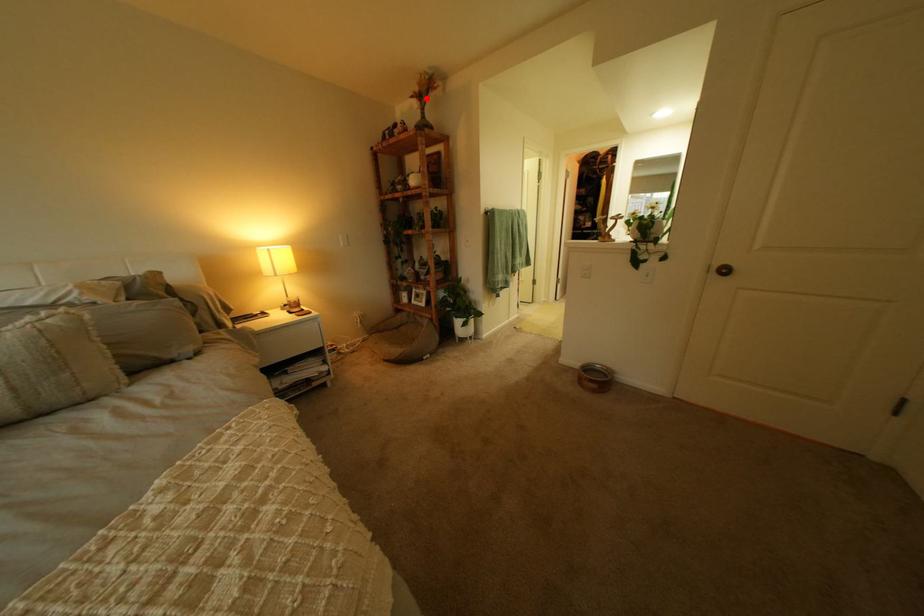
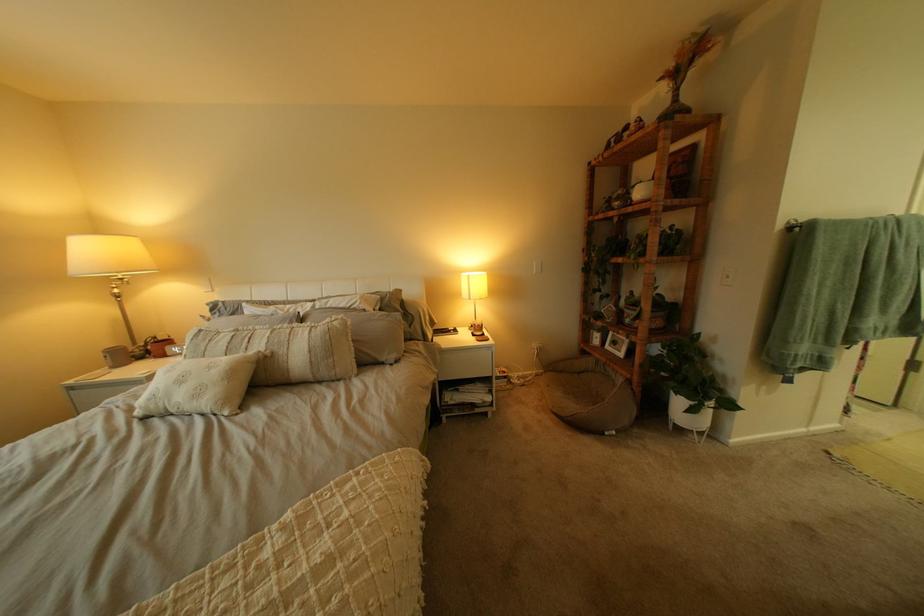
Find the pixel in the second image that matches the highlighted location in the first image.

(675, 81)